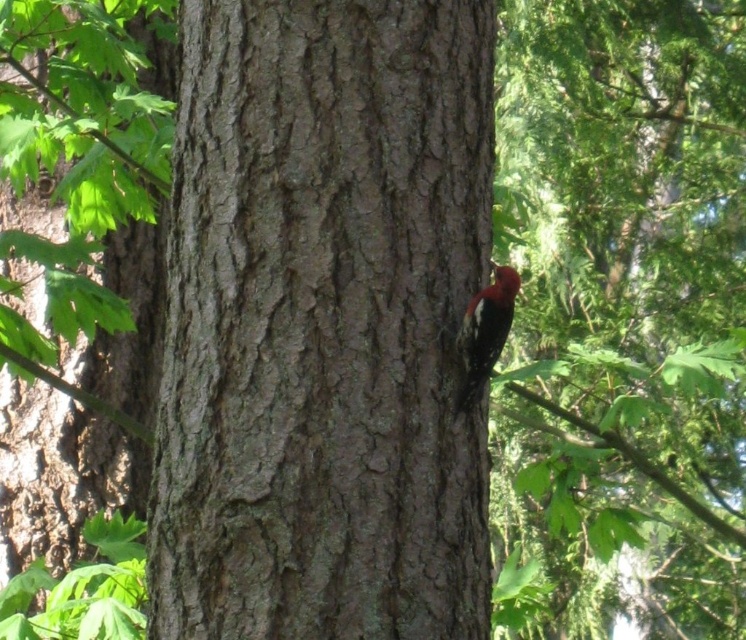
You are standing in front of the tree trunk and looking at the two points marked on the image. Which point, point [178,360] or point [466,337], is closer to you?

Point [178,360] is closer to you because it is in front of point [466,337].